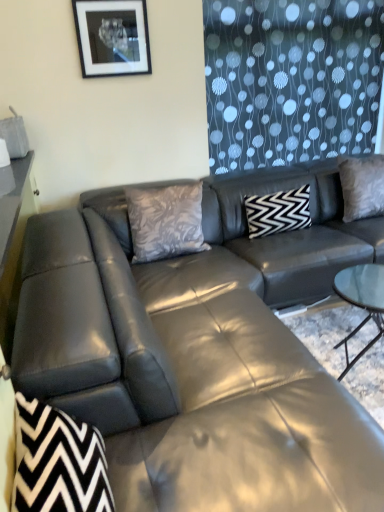
What are the coordinates of `silky gray pillow at center, which ranks as the 1th pillow in left-to-right order` in the screenshot? It's located at (165, 222).

The width and height of the screenshot is (384, 512). I want to click on silky gray pillow at upper right, the 1th pillow positioned from the right, so click(362, 186).

Which of these two, matte black leather couch at center or silky gray pillow at center, arranged as the third pillow when viewed from the right, is wider?

Wider between the two is matte black leather couch at center.

From the image's perspective, is matte black leather couch at center above silky gray pillow at center, arranged as the third pillow when viewed from the right?

No, from the image's perspective, matte black leather couch at center is not above silky gray pillow at center, arranged as the third pillow when viewed from the right.

Is matte black leather couch at center taller or shorter than silky gray pillow at center, arranged as the third pillow when viewed from the right?

Clearly, matte black leather couch at center is taller compared to silky gray pillow at center, arranged as the third pillow when viewed from the right.

Based on the photo, considering the relative sizes of matte black leather couch at center and silky gray pillow at center, which ranks as the 1th pillow in left-to-right order, in the image provided, is matte black leather couch at center bigger than silky gray pillow at center, which ranks as the 1th pillow in left-to-right order,?

Correct, matte black leather couch at center is larger in size than silky gray pillow at center, which ranks as the 1th pillow in left-to-right order.

From the image's perspective, is silky gray pillow at upper right, the 1th pillow positioned from the right, above matte black picture frame at upper center?

Incorrect, from the image's perspective, silky gray pillow at upper right, the 1th pillow positioned from the right, is lower than matte black picture frame at upper center.

Is matte black picture frame at upper center inside silky gray pillow at upper right, the 1th pillow positioned from the right?

No, silky gray pillow at upper right, the 1th pillow positioned from the right, does not contain matte black picture frame at upper center.

Could you measure the distance between silky gray pillow at upper right, the 1th pillow positioned from the right, and matte black picture frame at upper center?

The distance of silky gray pillow at upper right, the 1th pillow positioned from the right, from matte black picture frame at upper center is 5.51 feet.

Which object is positioned more to the right, silky gray pillow at upper right, the 1th pillow positioned from the right, or matte black picture frame at upper center?

From the viewer's perspective, silky gray pillow at upper right, the 1th pillow positioned from the right, appears more on the right side.

From a real-world perspective, is matte black picture frame at upper center positioned under silky gray pillow at upper right, marked as the 3th pillow in a left-to-right arrangement, based on gravity?

Incorrect, from a real-world perspective, matte black picture frame at upper center is higher than silky gray pillow at upper right, marked as the 3th pillow in a left-to-right arrangement.

Considering the positions of objects matte black picture frame at upper center and silky gray pillow at upper right, marked as the 3th pillow in a left-to-right arrangement, in the image provided, who is in front, matte black picture frame at upper center or silky gray pillow at upper right, marked as the 3th pillow in a left-to-right arrangement,?

matte black picture frame at upper center is more forward.

Considering the relative sizes of matte black picture frame at upper center and silky gray pillow at upper right, the 1th pillow positioned from the right, in the image provided, is matte black picture frame at upper center smaller than silky gray pillow at upper right, the 1th pillow positioned from the right,?

Correct, matte black picture frame at upper center occupies less space than silky gray pillow at upper right, the 1th pillow positioned from the right.

How many degrees apart are the facing directions of matte black picture frame at upper center and silky gray pillow at upper right, the 1th pillow positioned from the right?

1.24 degrees separate the facing orientations of matte black picture frame at upper center and silky gray pillow at upper right, the 1th pillow positioned from the right.

Is black zigzag fabric swivel chair at lower left aimed at matte black leather couch at center?

Yes, black zigzag fabric swivel chair at lower left is turned towards matte black leather couch at center.

In the scene shown: Which object is positioned more to the right, black zigzag fabric swivel chair at lower left or matte black leather couch at center?

From the viewer's perspective, matte black leather couch at center appears more on the right side.

Based on the photo, does black zigzag fabric swivel chair at lower left have a greater height compared to matte black leather couch at center?

No, black zigzag fabric swivel chair at lower left is not taller than matte black leather couch at center.

Is silky gray pillow at center, which ranks as the 1th pillow in left-to-right order, inside the boundaries of matte black leather couch at center, or outside?

The correct answer is: inside.

Between silky gray pillow at center, arranged as the third pillow when viewed from the right, and matte black leather couch at center, which one has larger width?

With larger width is matte black leather couch at center.

Considering the sizes of objects silky gray pillow at center, arranged as the third pillow when viewed from the right, and matte black leather couch at center in the image provided, who is shorter, silky gray pillow at center, arranged as the third pillow when viewed from the right, or matte black leather couch at center?

silky gray pillow at center, arranged as the third pillow when viewed from the right.

Is silky gray pillow at center, which ranks as the 1th pillow in left-to-right order, aimed at matte black leather couch at center?

Yes, silky gray pillow at center, which ranks as the 1th pillow in left-to-right order, is aimed at matte black leather couch at center.

Is black and white zigzag pillow at center, acting as the second pillow starting from the left, a part of matte black picture frame at upper center?

Definitely not — black and white zigzag pillow at center, acting as the second pillow starting from the left, is not inside matte black picture frame at upper center.

Which of these two, matte black picture frame at upper center or black and white zigzag pillow at center, the 2th pillow viewed from the right, is smaller?

matte black picture frame at upper center is smaller.

In terms of height, does matte black picture frame at upper center look taller or shorter compared to black and white zigzag pillow at center, acting as the second pillow starting from the left?

In the image, matte black picture frame at upper center appears to be taller than black and white zigzag pillow at center, acting as the second pillow starting from the left.

Based on the photo, which is less distant, (x=141, y=36) or (x=291, y=221)?

Point (x=141, y=36).

From the image's perspective, starting from the silky gray pillow at center, which ranks as the 1th pillow in left-to-right order, which pillow is the 2nd one above? Please provide its 2D coordinates.

[(362, 186)]

From the image's perspective, is silky gray pillow at upper right, marked as the 3th pillow in a left-to-right arrangement, positioned above or below silky gray pillow at center, arranged as the third pillow when viewed from the right?

From the image's perspective, silky gray pillow at upper right, marked as the 3th pillow in a left-to-right arrangement, appears above silky gray pillow at center, arranged as the third pillow when viewed from the right.

Is point (379, 170) less distant than point (177, 222)?

That is False.

From a real-world perspective, starting from the matte black leather couch at center, which pillow is the 2nd one vertically above it? Please provide its 2D coordinates.

[(165, 222)]

Starting from the matte black picture frame at upper center, which pillow is the 2nd one behind? Please provide its 2D coordinates.

[(362, 186)]

From the image, which object appears to be farther from silky gray pillow at upper right, marked as the 3th pillow in a left-to-right arrangement, black and white zigzag pillow at center, the 2th pillow viewed from the right, or matte black picture frame at upper center?

matte black picture frame at upper center.

Based on the photo, estimate the real-world distances between objects in this image. Which object is closer to matte black leather couch at center, black zigzag fabric swivel chair at lower left or matte black picture frame at upper center?

black zigzag fabric swivel chair at lower left lies closer to matte black leather couch at center than the other object.

Looking at the image, which one is located closer to black and white zigzag pillow at center, acting as the second pillow starting from the left, silky gray pillow at center, which ranks as the 1th pillow in left-to-right order, or matte black picture frame at upper center?

silky gray pillow at center, which ranks as the 1th pillow in left-to-right order.

Estimate the real-world distances between objects in this image. Which object is further from silky gray pillow at upper right, the 1th pillow positioned from the right, silky gray pillow at center, which ranks as the 1th pillow in left-to-right order, or black and white zigzag pillow at center, acting as the second pillow starting from the left?

silky gray pillow at center, which ranks as the 1th pillow in left-to-right order.

In the scene shown: When comparing their distances from black zigzag fabric swivel chair at lower left, does matte black picture frame at upper center or black and white zigzag pillow at center, the 2th pillow viewed from the right, seem further?

matte black picture frame at upper center lies further to black zigzag fabric swivel chair at lower left than the other object.

Looking at the image, which one is located closer to matte black leather couch at center, black and white zigzag pillow at center, acting as the second pillow starting from the left, or silky gray pillow at center, which ranks as the 1th pillow in left-to-right order?

silky gray pillow at center, which ranks as the 1th pillow in left-to-right order, is closer to matte black leather couch at center.

Which object lies further to the anchor point matte black picture frame at upper center, black zigzag fabric swivel chair at lower left or silky gray pillow at center, arranged as the third pillow when viewed from the right?

black zigzag fabric swivel chair at lower left is positioned further to the anchor matte black picture frame at upper center.

Which object lies further to the anchor point matte black picture frame at upper center, silky gray pillow at upper right, marked as the 3th pillow in a left-to-right arrangement, or black zigzag fabric swivel chair at lower left?

black zigzag fabric swivel chair at lower left is positioned further to the anchor matte black picture frame at upper center.

In order to click on picture frame located between matte black leather couch at center and black and white zigzag pillow at center, the 2th pillow viewed from the right, in the depth direction in this screenshot , I will do `click(112, 37)`.

The height and width of the screenshot is (512, 384). I want to click on swivel chair located between matte black leather couch at center and matte black picture frame at upper center in the depth direction, so click(58, 462).

Where is `swivel chair between matte black leather couch at center and black and white zigzag pillow at center, acting as the second pillow starting from the left, along the z-axis`? The width and height of the screenshot is (384, 512). swivel chair between matte black leather couch at center and black and white zigzag pillow at center, acting as the second pillow starting from the left, along the z-axis is located at coordinates (58, 462).

This screenshot has height=512, width=384. In order to click on pillow between silky gray pillow at center, which ranks as the 1th pillow in left-to-right order, and silky gray pillow at upper right, the 1th pillow positioned from the right, from left to right in this screenshot , I will do `click(278, 212)`.